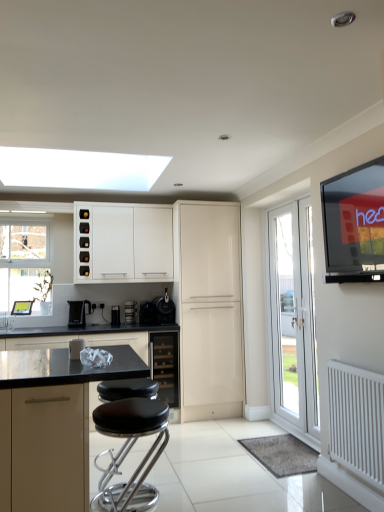
You are a GUI agent. You are given a task and a screenshot of the screen. Output one action in this format:
    pyautogui.click(x=<x>, y=<y>)
    Task: Click on the vacant space underneath black plastic coffee machine at lower left (from a real-world perspective)
    This screenshot has width=384, height=512.
    Given the screenshot: What is the action you would take?
    pyautogui.click(x=87, y=325)